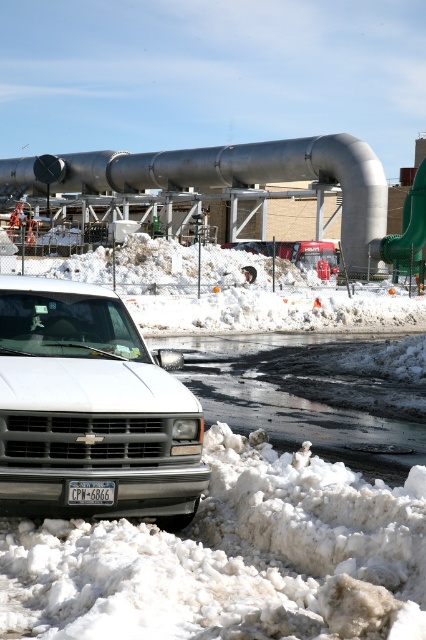
You are a delivery driver who needs to exit the industrial area. Your truck is the white matte truck at lower left. There is a brushed metal pipe at center blocking the path. Can your truck pass under the pipe without any modifications?

The white matte truck at lower left is smaller in size compared to the brushed metal pipe at center, so it is likely that the truck can pass under the pipe without needing modifications.

You are a maintenance worker inspecting the industrial site. You notice the brushed metal pipe at center and the matte black license plate at center. Which object is higher in elevation?

The brushed metal pipe at center is taller than the matte black license plate at center, so the brushed metal pipe at center is higher in elevation.

You are a delivery driver who needs to navigate through the industrial area shown. You see the white matte truck at lower left and the brushed metal pipe at center. Which object is nearer to you as you approach the scene?

The white matte truck at lower left is closer to the viewer than the brushed metal pipe at center.